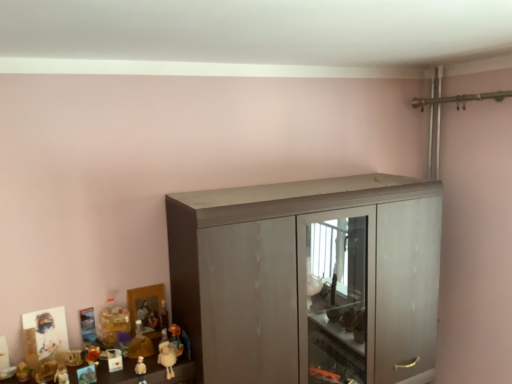
Question: Is white plush sheep at lower left, which ranks as the 8th toy in left-to-right order, positioned before matte brown figurine at lower left, the second toy when ordered from left to right?

Choices:
 (A) yes
 (B) no

Answer: (B)

Question: Is white plush sheep at lower left, which ranks as the 8th toy in left-to-right order, at the left side of matte brown figurine at lower left, which is the seventh toy from right to left?

Choices:
 (A) no
 (B) yes

Answer: (A)

Question: Does white plush sheep at lower left, which ranks as the 8th toy in left-to-right order, have a greater width compared to matte brown figurine at lower left, the second toy when ordered from left to right?

Choices:
 (A) no
 (B) yes

Answer: (B)

Question: From a real-world perspective, does white plush sheep at lower left, positioned as the first toy in right-to-left order, stand above matte brown figurine at lower left, which is the seventh toy from right to left?

Choices:
 (A) yes
 (B) no

Answer: (B)

Question: Is white plush sheep at lower left, positioned as the first toy in right-to-left order, outside of matte brown figurine at lower left, which is the seventh toy from right to left?

Choices:
 (A) no
 (B) yes

Answer: (B)

Question: Considering the relative sizes of white plush sheep at lower left, which ranks as the 8th toy in left-to-right order, and matte brown figurine at lower left, the second toy when ordered from left to right, in the image provided, is white plush sheep at lower left, which ranks as the 8th toy in left-to-right order, bigger than matte brown figurine at lower left, the second toy when ordered from left to right,?

Choices:
 (A) yes
 (B) no

Answer: (A)

Question: Considering the relative sizes of matte plastic toy at lower left, positioned as the eighth toy in right-to-left order, and matte brown figurine at lower left, the second toy when ordered from left to right, in the image provided, is matte plastic toy at lower left, positioned as the eighth toy in right-to-left order, thinner than matte brown figurine at lower left, the second toy when ordered from left to right,?

Choices:
 (A) no
 (B) yes

Answer: (A)

Question: Are matte plastic toy at lower left, which is the 1th toy from left to right, and matte brown figurine at lower left, which is the seventh toy from right to left, making contact?

Choices:
 (A) no
 (B) yes

Answer: (A)

Question: Does matte plastic toy at lower left, which is the 1th toy from left to right, have a greater width compared to matte brown figurine at lower left, the second toy when ordered from left to right?

Choices:
 (A) no
 (B) yes

Answer: (B)

Question: Is matte plastic toy at lower left, which is the 1th toy from left to right, to the right of matte brown figurine at lower left, the second toy when ordered from left to right, from the viewer's perspective?

Choices:
 (A) no
 (B) yes

Answer: (A)

Question: Is matte plastic toy at lower left, which is the 1th toy from left to right, to the left of matte brown figurine at lower left, the second toy when ordered from left to right, from the viewer's perspective?

Choices:
 (A) yes
 (B) no

Answer: (A)

Question: Is the depth of matte plastic toy at lower left, acting as the 4th toy starting from the left, greater than that of matte gray cupboard at center?

Choices:
 (A) yes
 (B) no

Answer: (A)